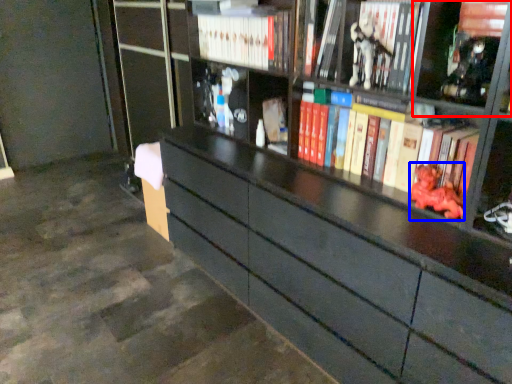
Question: Among these objects, which one is farthest to the camera, cabinet (highlighted by a red box) or toy (highlighted by a blue box)?

Choices:
 (A) cabinet
 (B) toy

Answer: (B)